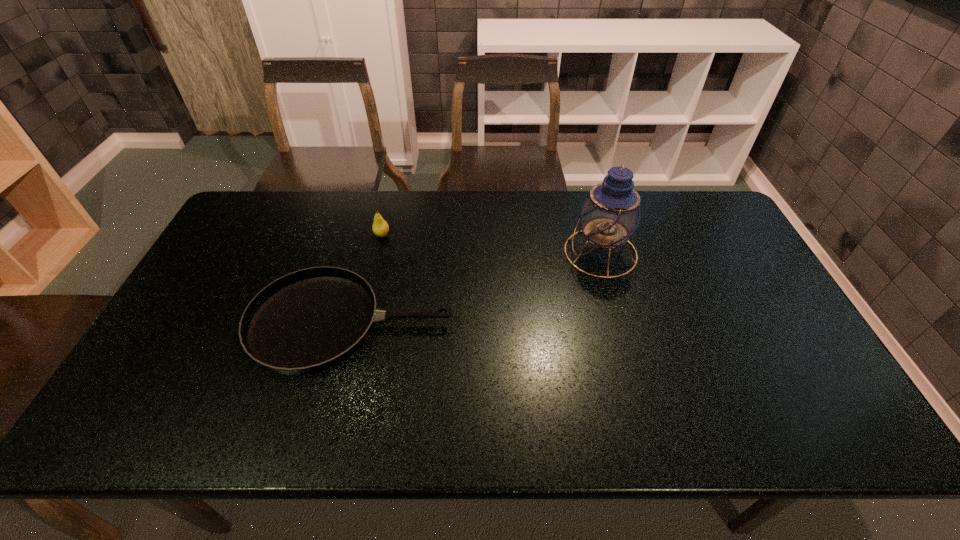
At what (x,y) coordinates should I click in order to perform the action: click on free space between the tallest object and the shortest object. Please return your answer as a coordinate pair (x, y). The image size is (960, 540). Looking at the image, I should click on (476, 288).

In order to click on free point between the rightmost object and the shortest object in this screenshot , I will do `click(476, 288)`.

This screenshot has width=960, height=540. I want to click on unoccupied position between the frying pan and the second tallest object, so click(x=367, y=279).

This screenshot has height=540, width=960. What are the coordinates of `empty space that is in between the frying pan and the lantern` in the screenshot? It's located at (476, 288).

Where is `empty location between the rightmost object and the shortest object`? The width and height of the screenshot is (960, 540). empty location between the rightmost object and the shortest object is located at coordinates (476, 288).

I want to click on empty location between the shortest object and the tallest object, so click(x=476, y=288).

Find the location of a particular element. empty space between the lantern and the pear is located at coordinates click(492, 244).

Locate an element on the screen. The width and height of the screenshot is (960, 540). object that is the second nearest to the lantern is located at coordinates (380, 227).

Find the location of `object that is the second closest one to the frying pan`. object that is the second closest one to the frying pan is located at coordinates (611, 213).

What are the coordinates of `vacant space that satisfies the following two spatial constraints: 1. on the front side of the second shortest object; 2. on the handle side of the shortest object` in the screenshot? It's located at (361, 323).